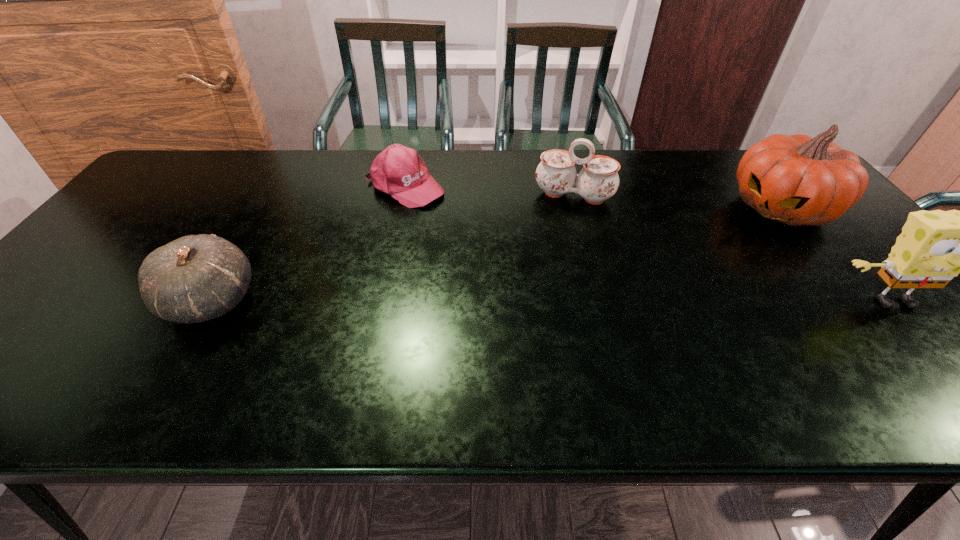
Identify the location of the leftmost object. (195, 278).

Where is `pumpkin`? Image resolution: width=960 pixels, height=540 pixels. pumpkin is located at coordinates (797, 180).

Where is `the third object from left to right`? Image resolution: width=960 pixels, height=540 pixels. the third object from left to right is located at coordinates (556, 175).

You are a GUI agent. You are given a task and a screenshot of the screen. Output one action in this format:
    pyautogui.click(x=<x>, y=<y>)
    Task: Click on the fourth object from right to left
    The width and height of the screenshot is (960, 540).
    Given the screenshot: What is the action you would take?
    pyautogui.click(x=398, y=171)

Locate an element on the screen. The width and height of the screenshot is (960, 540). the shortest object is located at coordinates (398, 171).

What are the coordinates of `free location located 0.290m on the right of the gourd` in the screenshot? It's located at (384, 301).

Where is `vacant space situated 0.150m on the face of the pumpkin`? vacant space situated 0.150m on the face of the pumpkin is located at coordinates (722, 248).

Find the location of a particular element. Image resolution: width=960 pixels, height=540 pixels. free point located on the face of the pumpkin is located at coordinates click(741, 235).

Identify the location of free space located on the face of the pumpkin. (662, 291).

You are a GUI agent. You are given a task and a screenshot of the screen. Output one action in this format:
    pyautogui.click(x=<x>, y=<y>)
    Task: Click on the vacant region located 0.120m by the handle of the chinaware
    The height and width of the screenshot is (540, 960).
    Given the screenshot: What is the action you would take?
    pyautogui.click(x=559, y=236)